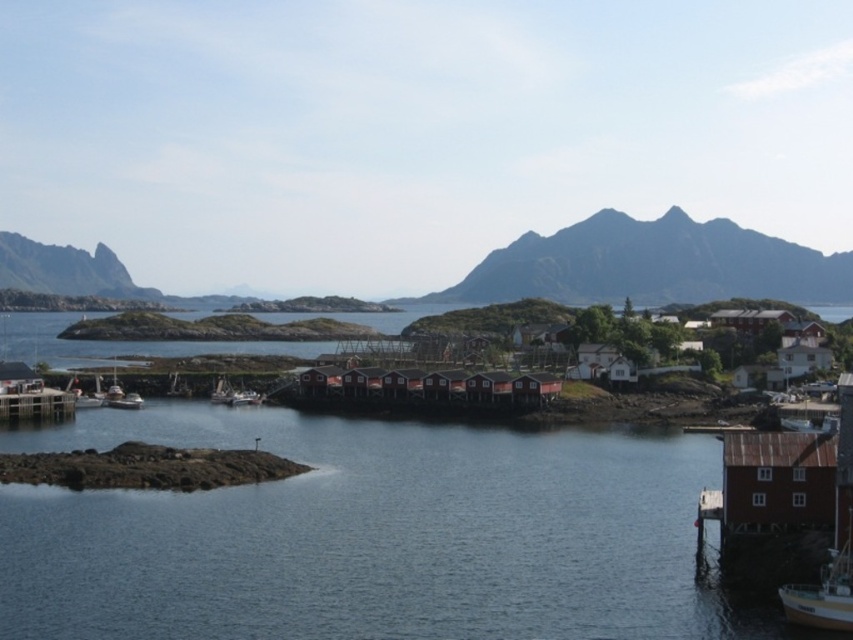
Question: Among these points, which one is nearest to the camera?

Choices:
 (A) (479, 381)
 (B) (120, 483)
 (C) (77, 392)
 (D) (9, 388)

Answer: (B)

Question: Among these points, which one is nearest to the camera?

Choices:
 (A) (833, 564)
 (B) (753, 237)

Answer: (A)

Question: Can you confirm if red wooden dock at center is thinner than metallic silver boat at lower left?

Choices:
 (A) yes
 (B) no

Answer: (B)

Question: Which of the following is the farthest from the observer?

Choices:
 (A) (113, 278)
 (B) (310, 371)
 (C) (619, 284)
 (D) (221, 388)

Answer: (A)

Question: Can you confirm if red wooden dock at center is positioned to the left of rugged stone mountain at upper left?

Choices:
 (A) no
 (B) yes

Answer: (A)

Question: Considering the relative positions of rugged stone mountain at upper center and red wooden dock at center in the image provided, where is rugged stone mountain at upper center located with respect to red wooden dock at center?

Choices:
 (A) left
 (B) right

Answer: (B)